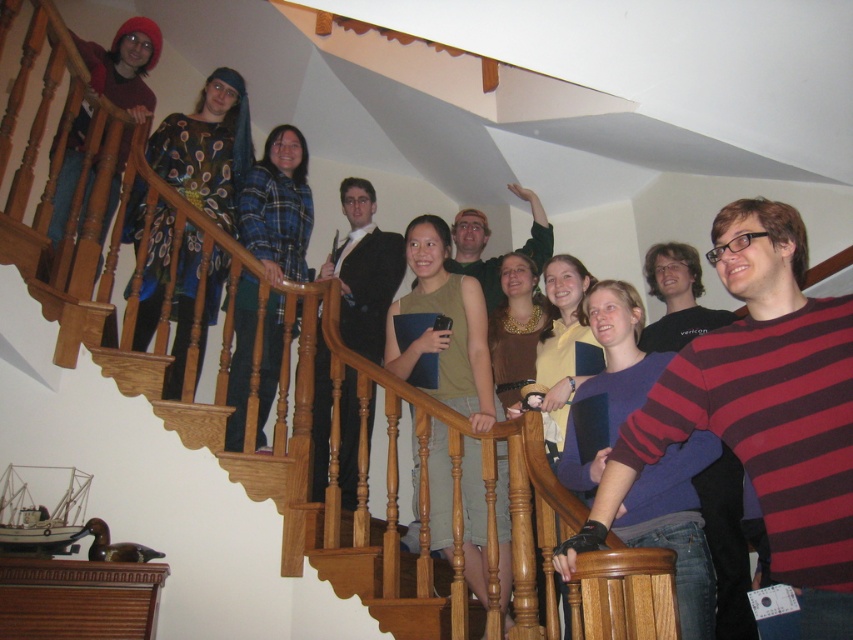
Question: Is matte green tank top at center to the right of blue plaid shirt at upper center from the viewer's perspective?

Choices:
 (A) no
 (B) yes

Answer: (B)

Question: Estimate the real-world distances between objects in this image. Which object is closer to the matte green tank top at center?

Choices:
 (A) purple cotton sweater at center
 (B) black suit jacket at center

Answer: (B)

Question: In this image, where is striped sweater at center located relative to floral-patterned dress at upper left?

Choices:
 (A) right
 (B) left

Answer: (A)

Question: Is purple cotton sweater at center closer to the viewer compared to black suit jacket at center?

Choices:
 (A) no
 (B) yes

Answer: (B)

Question: Considering the real-world distances, which object is farthest from the blue plaid shirt at upper center?

Choices:
 (A) floral-patterned dress at upper left
 (B) striped sweater at center

Answer: (B)

Question: Among these objects, which one is farthest from the camera?

Choices:
 (A) striped sweater at center
 (B) blue plaid shirt at upper center
 (C) black suit jacket at center
 (D) floral-patterned dress at upper left

Answer: (B)